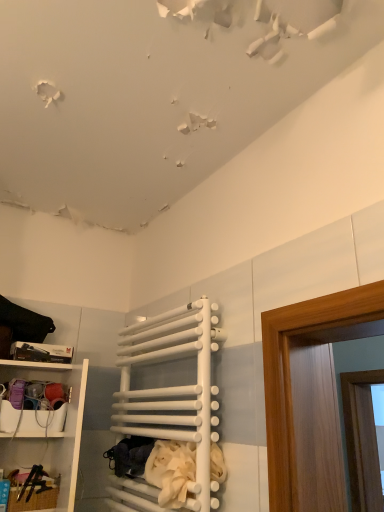
Question: Is beige fabric laundry at lower center turned away from white matte towel rack at center?

Choices:
 (A) no
 (B) yes

Answer: (B)

Question: From the image's perspective, is beige fabric laundry at lower center on top of white matte towel rack at center?

Choices:
 (A) yes
 (B) no

Answer: (B)

Question: Is beige fabric laundry at lower center far from white matte towel rack at center?

Choices:
 (A) yes
 (B) no

Answer: (B)

Question: Considering the relative sizes of beige fabric laundry at lower center and white matte towel rack at center in the image provided, is beige fabric laundry at lower center smaller than white matte towel rack at center?

Choices:
 (A) yes
 (B) no

Answer: (A)

Question: Does beige fabric laundry at lower center have a lesser height compared to white matte towel rack at center?

Choices:
 (A) yes
 (B) no

Answer: (A)

Question: From a real-world perspective, is beige fabric laundry at lower center located higher than white matte towel rack at center?

Choices:
 (A) yes
 (B) no

Answer: (B)

Question: From a real-world perspective, does white matte towel rack at center sit lower than white plastic shelf at lower left?

Choices:
 (A) yes
 (B) no

Answer: (B)

Question: Is white plastic shelf at lower left a part of white matte towel rack at center?

Choices:
 (A) no
 (B) yes

Answer: (A)

Question: Considering the relative positions of white matte towel rack at center and white plastic shelf at lower left in the image provided, is white matte towel rack at center in front of white plastic shelf at lower left?

Choices:
 (A) no
 (B) yes

Answer: (B)

Question: Could you tell me if white matte towel rack at center is turned towards white plastic shelf at lower left?

Choices:
 (A) yes
 (B) no

Answer: (A)

Question: From the image's perspective, does white matte towel rack at center appear higher than white plastic shelf at lower left?

Choices:
 (A) yes
 (B) no

Answer: (A)

Question: Is white matte towel rack at center smaller than white plastic shelf at lower left?

Choices:
 (A) no
 (B) yes

Answer: (B)

Question: From a real-world perspective, is white plastic shelf at lower left under white matte towel rack at center?

Choices:
 (A) yes
 (B) no

Answer: (A)